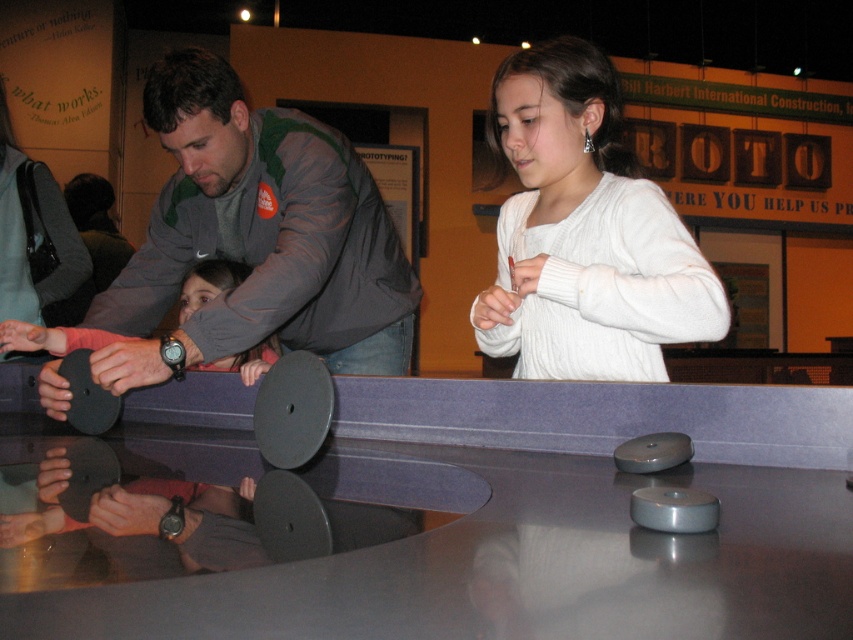
Question: Which point appears farthest from the camera in this image?

Choices:
 (A) (192, 356)
 (B) (96, 384)
 (C) (535, 253)
 (D) (125, 472)

Answer: (B)

Question: Does gray/green jacket at upper left have a lesser width compared to white knitted sweater at upper center?

Choices:
 (A) yes
 (B) no

Answer: (B)

Question: Does white knitted sweater at upper center appear over black rubber table tennis table at lower left?

Choices:
 (A) yes
 (B) no

Answer: (A)

Question: Which is farther from the metallic gray table at center?

Choices:
 (A) gray/green jacket at upper left
 (B) black rubber table tennis table at lower left

Answer: (B)

Question: Does metallic gray table at center appear over white knitted sweater at upper center?

Choices:
 (A) yes
 (B) no

Answer: (B)

Question: Which point is closer to the camera?

Choices:
 (A) gray/green jacket at upper left
 (B) white knitted sweater at upper center
 (C) black rubber table tennis table at lower left
 (D) metallic gray table at center

Answer: (D)